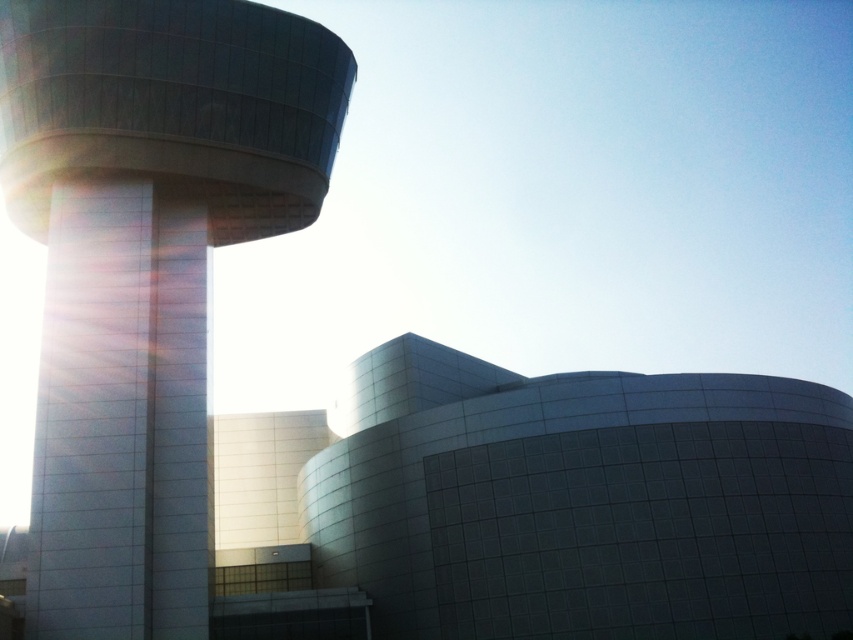
From the picture: You are an architect assessing the building design. Based on the scene, which object between the smooth glass tower at left and the white glossy pillar at left is taller?

The smooth glass tower at left is taller than the white glossy pillar at left according to the description.

You are standing at point (144, 268) in the image. What object are you directly facing?

You are directly facing the smooth glass tower at left.